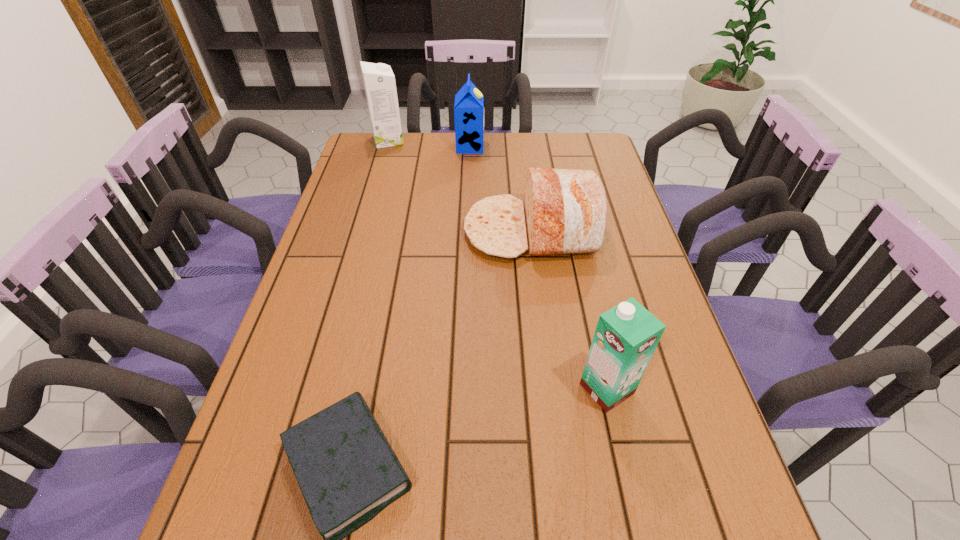
In order to click on vacant region located at the sliced end of the third nearest object in this screenshot , I will do `click(417, 231)`.

This screenshot has height=540, width=960. In order to click on object that is at the left edge in this screenshot , I will do `click(379, 82)`.

I want to click on carton located at the right edge, so click(626, 336).

Locate an element on the screen. The height and width of the screenshot is (540, 960). bread that is at the right edge is located at coordinates (566, 210).

Find the location of a particular element. object at the far left corner is located at coordinates (379, 82).

The height and width of the screenshot is (540, 960). Find the location of `free space at the far edge`. free space at the far edge is located at coordinates (546, 133).

Identify the location of vacant space at the left edge of the desktop. (366, 245).

Image resolution: width=960 pixels, height=540 pixels. I want to click on free space at the right edge of the desktop, so click(x=624, y=238).

Image resolution: width=960 pixels, height=540 pixels. What are the coordinates of `free location at the far left corner of the desktop` in the screenshot? It's located at (378, 166).

Image resolution: width=960 pixels, height=540 pixels. In the image, there is a desktop. In order to click on blank space at the far right corner in this screenshot , I will do `click(587, 160)`.